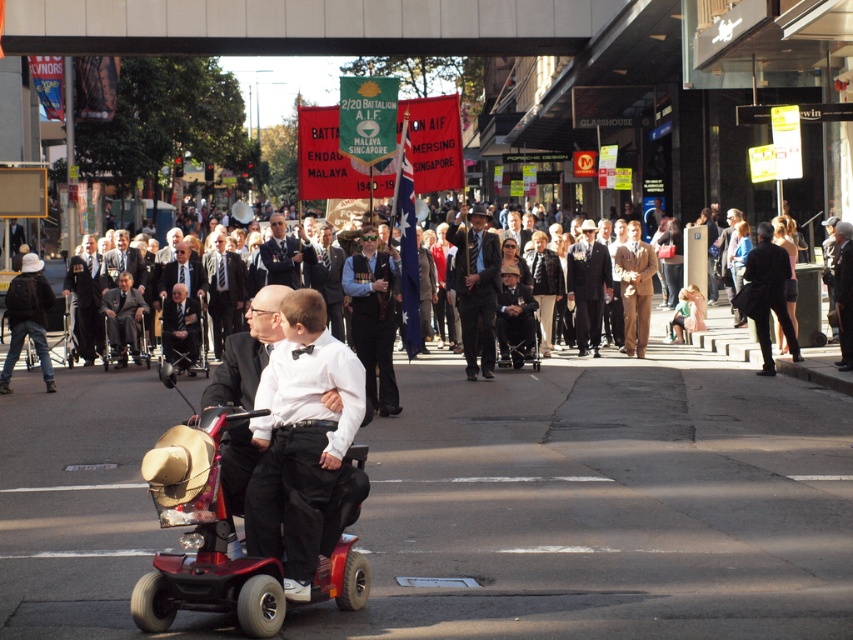
Question: Is dark gray suit at center below dark blue uniform at center?

Choices:
 (A) no
 (B) yes

Answer: (A)

Question: Which object is the closest to the red plastic mobility scooter at lower left?

Choices:
 (A) dark gray suit at center
 (B) dark blue suit at center
 (C) dark blue uniform at center
 (D) dark suit at center

Answer: (B)

Question: Is dark blue suit at center further to camera compared to dark blue uniform at center?

Choices:
 (A) yes
 (B) no

Answer: (B)

Question: Which object is positioned closest to the dark gray suit at center?

Choices:
 (A) dark blue suit at center
 (B) red plastic mobility scooter at lower left
 (C) dark blue uniform at center
 (D) dark suit at center

Answer: (C)

Question: Which object is positioned farthest from the dark blue uniform at center?

Choices:
 (A) dark blue suit at center
 (B) red plastic mobility scooter at lower left

Answer: (B)

Question: Is red plastic mobility scooter at lower left bigger than dark blue suit at center?

Choices:
 (A) no
 (B) yes

Answer: (A)